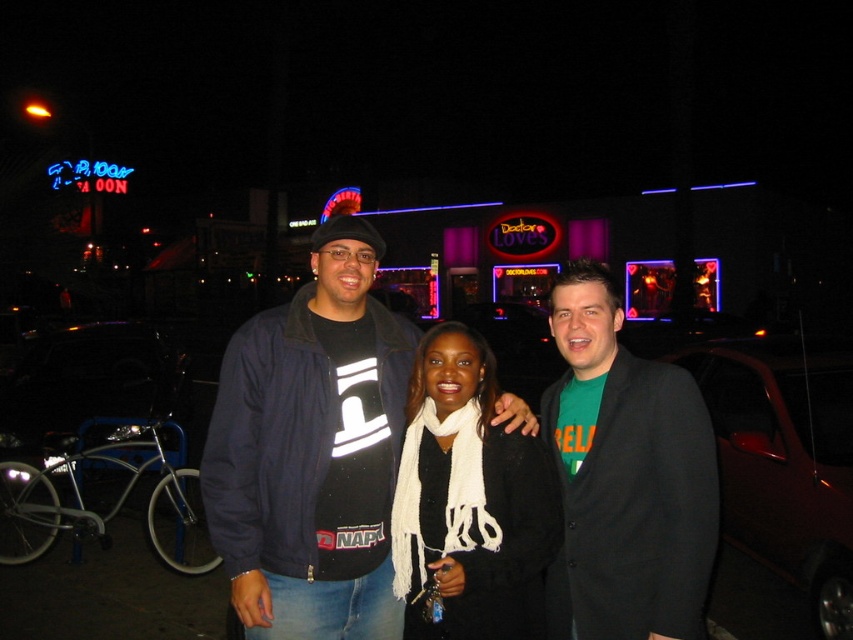
Question: Which object appears farthest from the camera in this image?

Choices:
 (A) dark red metallic car at right
 (B) dark blue jacket at center
 (C) green fabric shirt at center
 (D) white knitted scarf at center

Answer: (A)

Question: Is green fabric shirt at center below dark red metallic car at right?

Choices:
 (A) no
 (B) yes

Answer: (A)

Question: Which of the following is the closest to the observer?

Choices:
 (A) (393, 561)
 (B) (317, 417)

Answer: (B)

Question: Does green fabric shirt at center have a lesser width compared to white knitted scarf at center?

Choices:
 (A) no
 (B) yes

Answer: (B)

Question: Is green fabric shirt at center to the left of white knitted scarf at center from the viewer's perspective?

Choices:
 (A) yes
 (B) no

Answer: (B)

Question: Which object is the farthest from the white knitted scarf at center?

Choices:
 (A) dark blue jacket at center
 (B) dark red metallic car at right
 (C) green fabric shirt at center

Answer: (B)